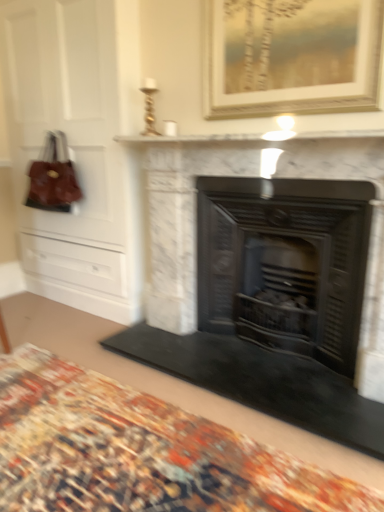
Question: Is black metal fireplace at center, the second fireplace when ordered from left to right, to the left of white marble fireplace at center, the first fireplace in the left-to-right sequence, from the viewer's perspective?

Choices:
 (A) yes
 (B) no

Answer: (B)

Question: Is black metal fireplace at center, which ranks as the 1th fireplace in right-to-left order, looking in the opposite direction of white marble fireplace at center, the second fireplace when ordered from right to left?

Choices:
 (A) no
 (B) yes

Answer: (B)

Question: Can you confirm if black metal fireplace at center, which ranks as the 1th fireplace in right-to-left order, is wider than white marble fireplace at center, the first fireplace in the left-to-right sequence?

Choices:
 (A) yes
 (B) no

Answer: (B)

Question: Can you confirm if black metal fireplace at center, the second fireplace when ordered from left to right, is smaller than white marble fireplace at center, the second fireplace when ordered from right to left?

Choices:
 (A) yes
 (B) no

Answer: (A)

Question: From a real-world perspective, is black metal fireplace at center, which ranks as the 1th fireplace in right-to-left order, physically below white marble fireplace at center, the second fireplace when ordered from right to left?

Choices:
 (A) no
 (B) yes

Answer: (B)

Question: From a real-world perspective, is black metal fireplace at center, the second fireplace when ordered from left to right, physically above white marble fireplace at center, the first fireplace in the left-to-right sequence?

Choices:
 (A) yes
 (B) no

Answer: (B)

Question: Is carpeted rug at lower center positioned far away from black metal fireplace at center, the second fireplace when ordered from left to right?

Choices:
 (A) no
 (B) yes

Answer: (A)

Question: Is the position of carpeted rug at lower center less distant than that of black metal fireplace at center, the second fireplace when ordered from left to right?

Choices:
 (A) yes
 (B) no

Answer: (A)

Question: Is carpeted rug at lower center with black metal fireplace at center, the second fireplace when ordered from left to right?

Choices:
 (A) yes
 (B) no

Answer: (B)

Question: Does carpeted rug at lower center have a smaller size compared to black metal fireplace at center, which ranks as the 1th fireplace in right-to-left order?

Choices:
 (A) yes
 (B) no

Answer: (A)

Question: From a real-world perspective, is carpeted rug at lower center on top of black metal fireplace at center, which ranks as the 1th fireplace in right-to-left order?

Choices:
 (A) yes
 (B) no

Answer: (B)

Question: Does carpeted rug at lower center have a lesser width compared to black metal fireplace at center, the second fireplace when ordered from left to right?

Choices:
 (A) no
 (B) yes

Answer: (A)

Question: Can you confirm if gold-framed painting at upper center is taller than leather handbag at left?

Choices:
 (A) yes
 (B) no

Answer: (A)